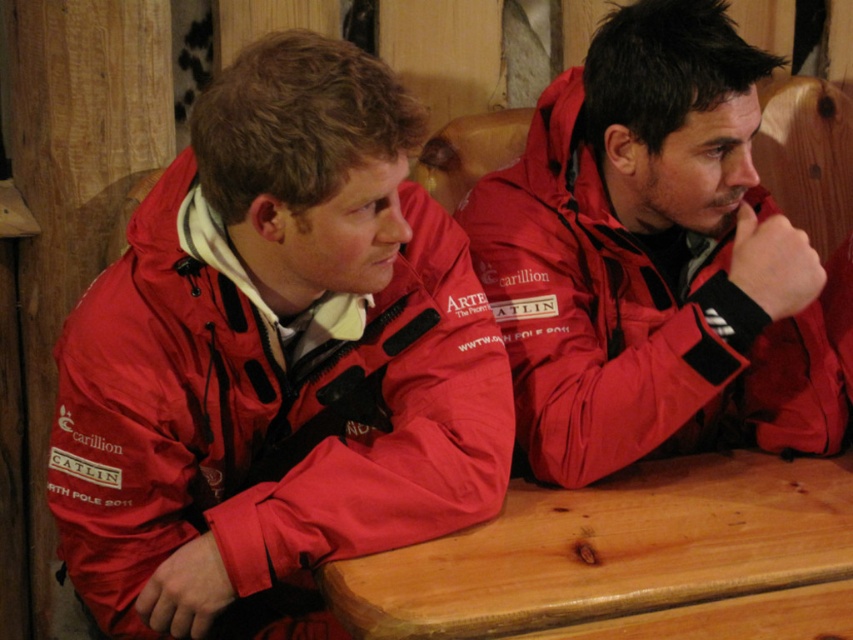
Looking at this image, you are a photographer setting up a shoot in this scene. You want to ensure the wooden table at center is visible in the background behind the matte red jacket at center. Is the current arrangement allowing this?

The wooden table at center is behind the matte red jacket at center, so yes, the current arrangement allows the wooden table at center to be visible in the background behind the matte red jacket at center.

You are designing a poster for a team event and need to know the relative sizes of the objects in the image. Based on the scene, which object is taller between the matte red jacket at left and the wooden table at center?

The matte red jacket at left is taller than the wooden table at center according to the description.